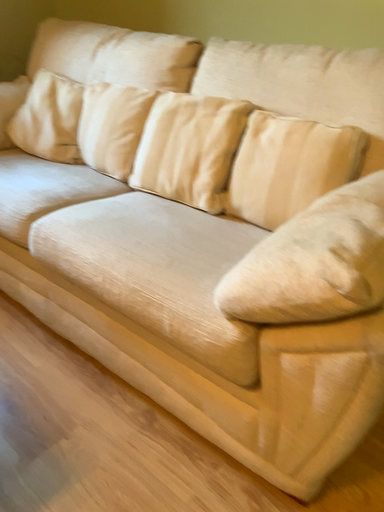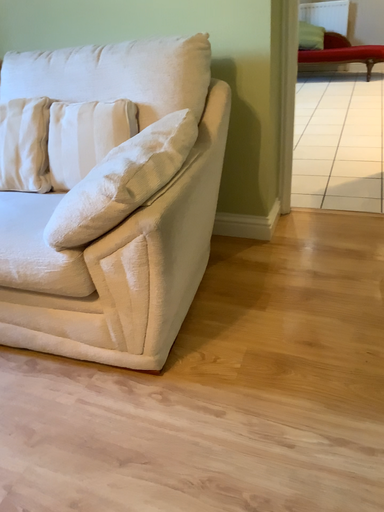
Question: How did the camera likely rotate when shooting the video?

Choices:
 (A) rotated right
 (B) rotated left

Answer: (A)